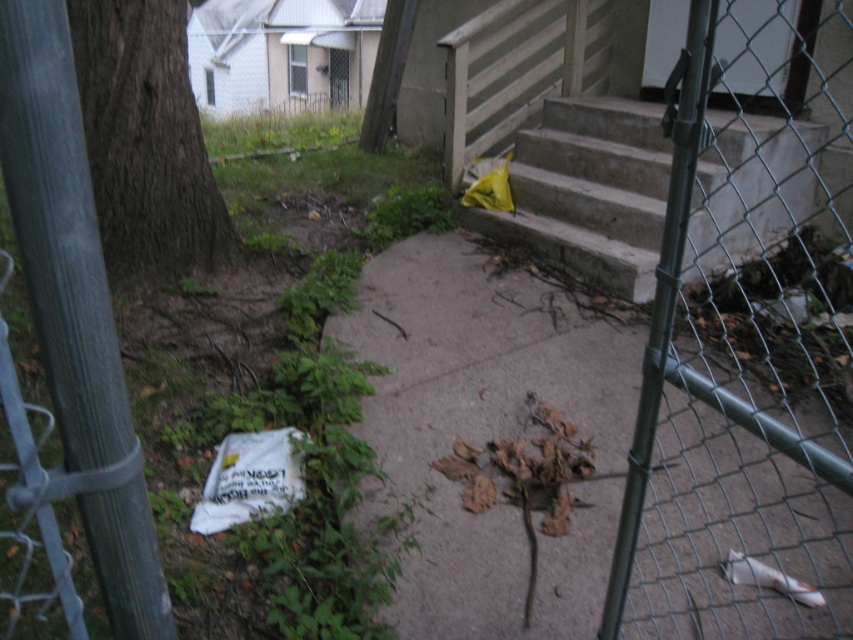
Question: Where is concrete stairs at center located in relation to brown rough bark tree at left in the image?

Choices:
 (A) left
 (B) right

Answer: (B)

Question: Is brown dirt pavement at center bigger than brown rough bark tree at left?

Choices:
 (A) yes
 (B) no

Answer: (A)

Question: Is concrete stairs at center positioned before brown rough bark tree at left?

Choices:
 (A) yes
 (B) no

Answer: (B)

Question: Which point is farther from the camera taking this photo?

Choices:
 (A) (148, 188)
 (B) (410, 300)

Answer: (A)

Question: Which of these objects is positioned closest to the brown rough bark tree at left?

Choices:
 (A) concrete stairs at center
 (B) brown dirt pavement at center

Answer: (B)

Question: Which object is farther from the camera taking this photo?

Choices:
 (A) concrete stairs at center
 (B) brown rough bark tree at left

Answer: (A)